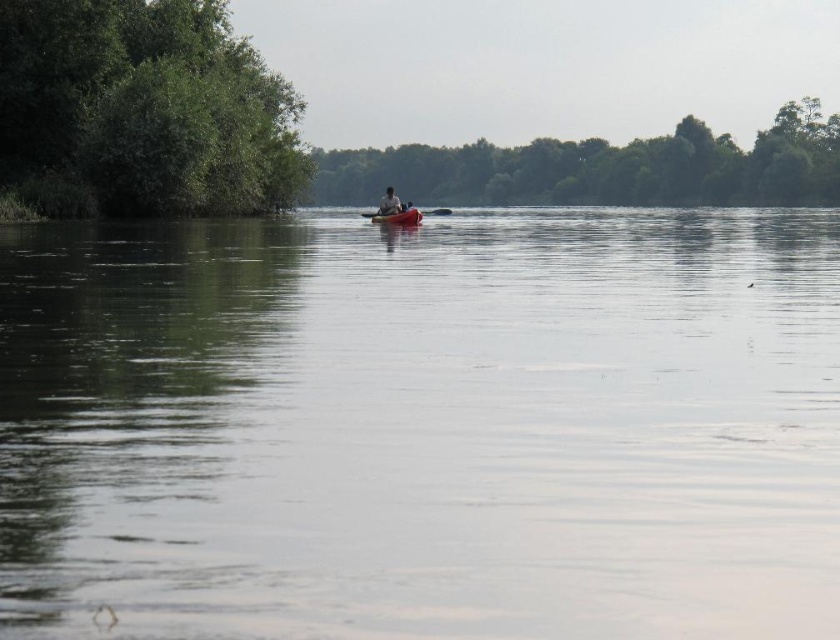
Which is in front, point (615, 284) or point (408, 212)?

Positioned in front is point (615, 284).

Between smooth water at center and matte plastic kayak at center, which one appears on the left side from the viewer's perspective?

Positioned to the left is matte plastic kayak at center.

Does point (155, 595) come closer to viewer compared to point (407, 212)?

Yes.

You are a GUI agent. You are given a task and a screenshot of the screen. Output one action in this format:
    pyautogui.click(x=<x>, y=<y>)
    Task: Click on the smooth water at center
    This screenshot has height=640, width=840.
    Given the screenshot: What is the action you would take?
    pyautogui.click(x=423, y=426)

In the scene shown: Who is shorter, green leafy trees at left or green leafy tree at center?

Standing shorter between the two is green leafy tree at center.

Can you confirm if green leafy trees at left is thinner than green leafy tree at center?

Indeed, green leafy trees at left has a lesser width compared to green leafy tree at center.

Is point (190, 61) positioned before point (685, 193)?

Yes, point (190, 61) is in front of point (685, 193).

I want to click on green leafy trees at left, so click(142, 112).

Consider the image. Who is higher up, matte red kayak at center or smooth plastic paddle at center?

smooth plastic paddle at center

Describe the element at coordinates (389, 204) in the screenshot. The height and width of the screenshot is (640, 840). I see `matte red kayak at center` at that location.

Locate an element on the screen. matte red kayak at center is located at coordinates (389, 204).